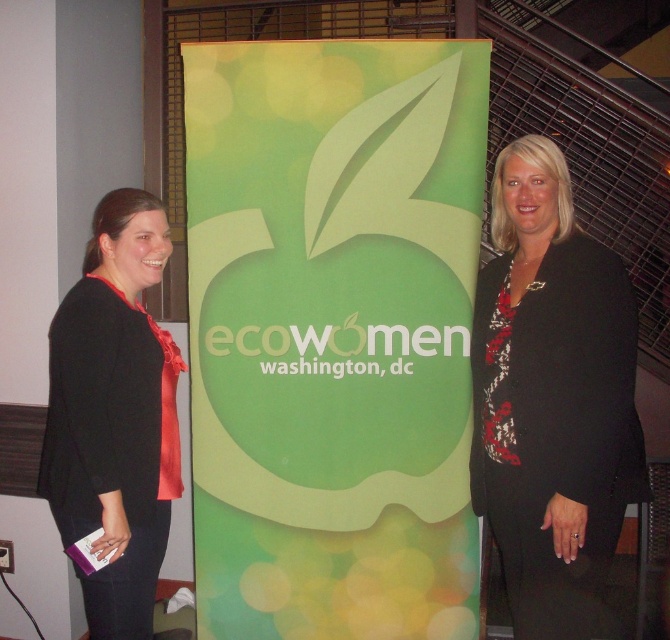
You are a photographer standing at the camera position. You want to take a photo of the black textured blazer at right but need to ensure it is within the frame. The camera has a focal length of 50mm and a sensor size of 24mm x 36mm. What is the minimum distance you must be from the blazer to ensure it fits entirely within the frame?

The black textured blazer at right is 1.92 meters away from the camera. Using the formula for depth of field and sensor size, the minimum distance required to ensure the blazer fits within the frame would be calculated based on the sensor dimensions and focal length. However, since the blazer is already at 1.92 meters, and assuming standard framing, it should already be within the frame at that distance.

You are a photographer trying to frame a shot of the black textured blazer at right and the woman on the left. Based on their positions, which object is closer to the center of the image?

The black textured blazer at right is closer to the center of the image because its 2D location at point (x=551, y=397) is nearer to the center coordinates than the woman on the left.

Looking at this image, you are a photographer setting up for a group photo. You need to position two people so that their outfits contrast in texture. The black satin blouse at left has a smooth texture, and the black textured blazer at right has a rougher surface. Based on their current positions in the image, which person should stand where to highlight this contrast effectively?

The person wearing the black satin blouse at left should stand on the left and the one in the black textured blazer at right should remain on the right to maintain their current positions, as the black textured blazer at right is already positioned on the right side of the black satin blouse at left, which helps in contrasting their textures effectively.